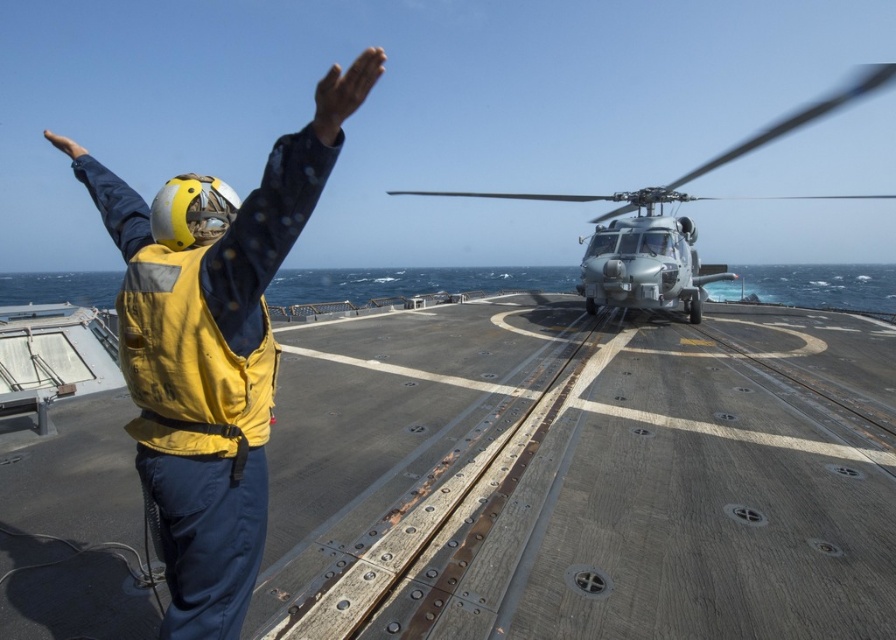
Is yellow fabric vest at left positioned in front of silver metallic helicopter at center?

That is True.

Which is behind, point (183, 564) or point (817, 113)?

The point (817, 113) is behind.

Find the location of `yellow fabric vest at left`. yellow fabric vest at left is located at coordinates (214, 353).